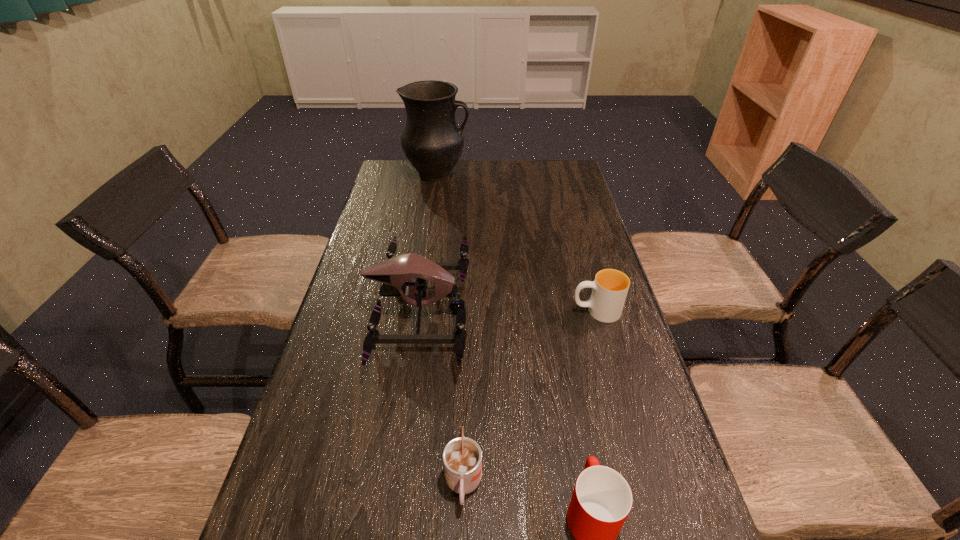
The width and height of the screenshot is (960, 540). Identify the location of vacant area that lies between the farthest cup and the farthest object. (516, 242).

Image resolution: width=960 pixels, height=540 pixels. Find the location of `free space between the farthest object and the leftmost cup`. free space between the farthest object and the leftmost cup is located at coordinates (450, 329).

This screenshot has width=960, height=540. What are the coordinates of `empty space between the farthest object and the drone` in the screenshot? It's located at (428, 242).

Identify the location of free space between the leftmost cup and the farthest object. The height and width of the screenshot is (540, 960). (450, 329).

The height and width of the screenshot is (540, 960). I want to click on object that is the third nearest to the second tallest object, so click(x=602, y=499).

Point out which object is positioned as the second nearest to the farthest cup. Please provide its 2D coordinates. Your answer should be formatted as a tuple, i.e. [(x, y)], where the tuple contains the x and y coordinates of a point satisfying the conditions above.

[(602, 499)]

Locate an element on the screen. The image size is (960, 540). cup that is the second nearest to the leftmost cup is located at coordinates (610, 287).

Identify which cup is located as the nearest to the farthest object. Please provide its 2D coordinates. Your answer should be formatted as a tuple, i.e. [(x, y)], where the tuple contains the x and y coordinates of a point satisfying the conditions above.

[(610, 287)]

At what (x,y) coordinates should I click in order to perform the action: click on vacant region that satisfies the following two spatial constraints: 1. with the handle on the side of the farthest cup; 2. on the handle side of the pitcher. Please return your answer as a coordinate pair (x, y). Image resolution: width=960 pixels, height=540 pixels. Looking at the image, I should click on (558, 174).

Identify the location of vacant space that satisfies the following two spatial constraints: 1. with the handle on the side of the farthest cup; 2. on the handle side of the farthest object. This screenshot has width=960, height=540. (558, 174).